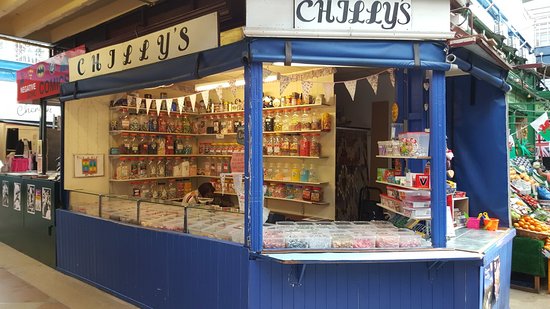
The image size is (550, 309). I want to click on wall, so click(x=148, y=281).